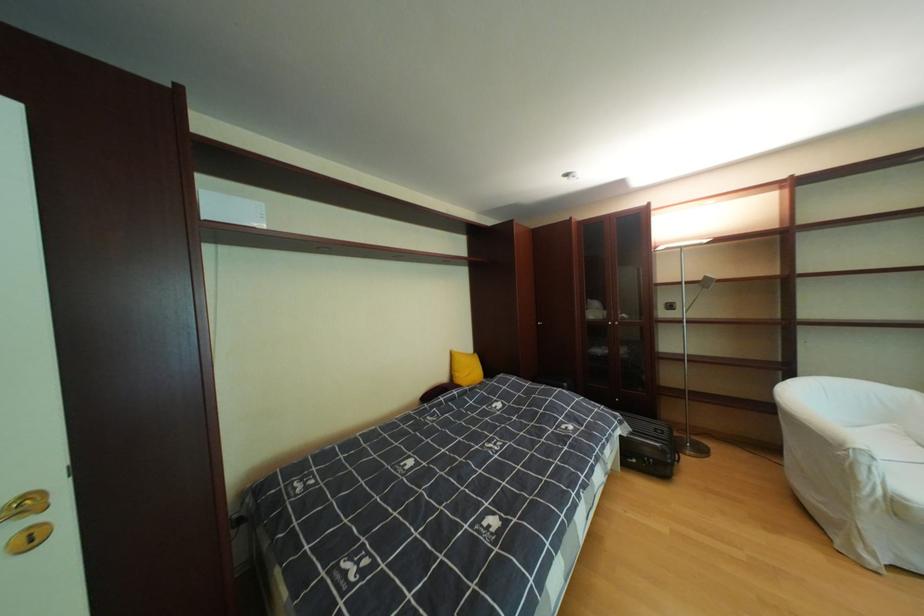
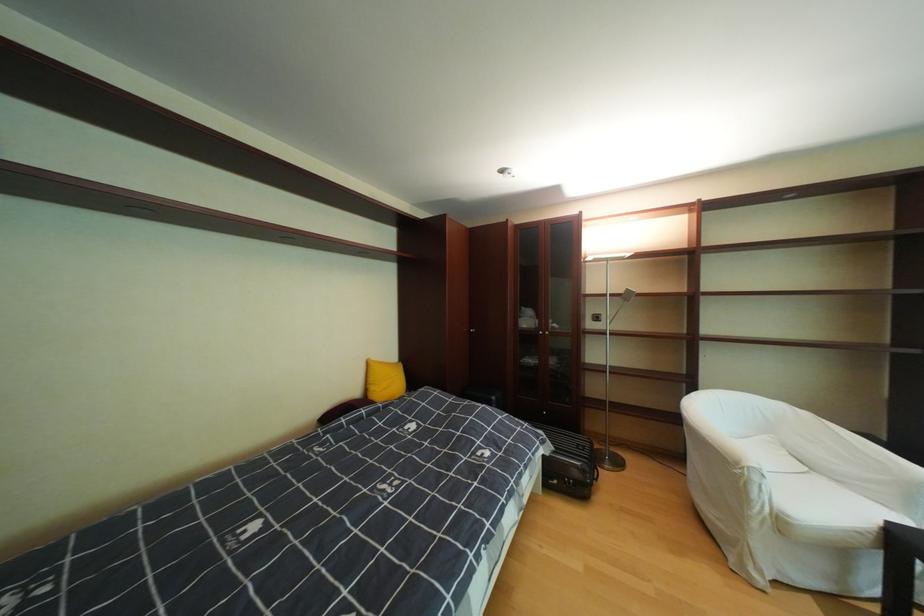
Find the pixel in the second image that matches (x=699, y=284) in the first image.

(624, 296)